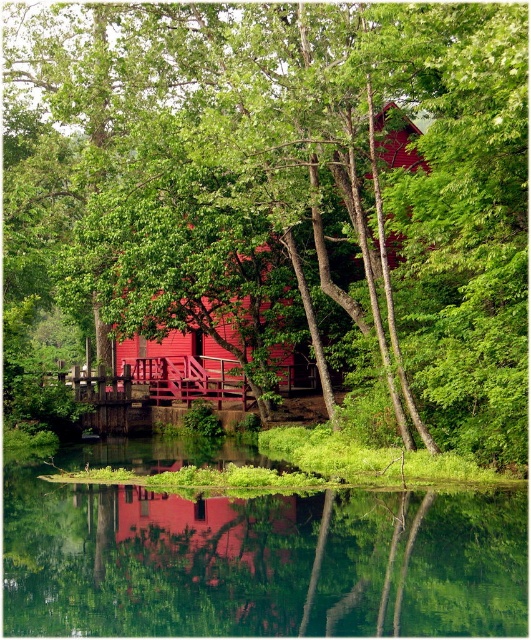
Can you confirm if green leafy tree at center is positioned above matte red cabin at center?

Yes, green leafy tree at center is above matte red cabin at center.

Does green leafy tree at center appear on the right side of matte red cabin at center?

Incorrect, green leafy tree at center is not on the right side of matte red cabin at center.

What do you see at coordinates (286, 195) in the screenshot?
I see `green leafy tree at center` at bounding box center [286, 195].

The height and width of the screenshot is (640, 531). I want to click on green leafy tree at center, so click(x=286, y=195).

Between green leafy tree at center and clear glass water at center, which one is positioned lower?

clear glass water at center is lower down.

Can you confirm if green leafy tree at center is bigger than clear glass water at center?

Indeed, green leafy tree at center has a larger size compared to clear glass water at center.

Is point (66, 276) closer to viewer compared to point (457, 531)?

That is False.

Where is `green leafy tree at center`? The height and width of the screenshot is (640, 531). green leafy tree at center is located at coordinates tap(286, 195).

Can you confirm if clear glass water at center is wider than matte red cabin at center?

Yes.

Does point (253, 593) lie in front of point (297, 278)?

Yes, point (253, 593) is closer to viewer.

Who is more forward, (10, 618) or (345, 307)?

Positioned in front is point (10, 618).

The width and height of the screenshot is (531, 640). Find the location of `clear glass water at center`. clear glass water at center is located at coordinates point(261,561).